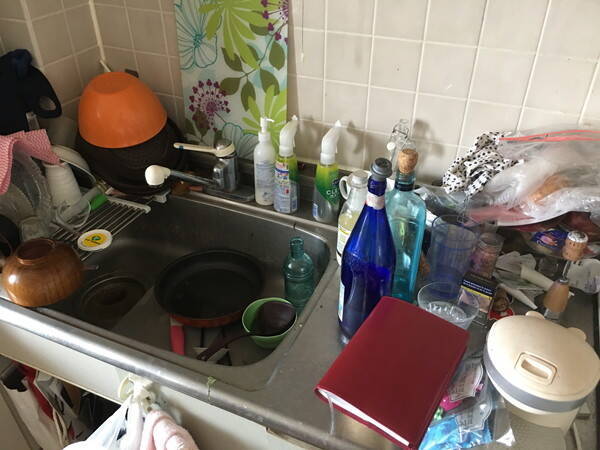
You are a GUI agent. You are given a task and a screenshot of the screen. Output one action in this format:
    pyautogui.click(x=<x>, y=<y>)
    Task: Click on the book
    The height and width of the screenshot is (450, 600).
    Given the screenshot: What is the action you would take?
    pyautogui.click(x=376, y=385)